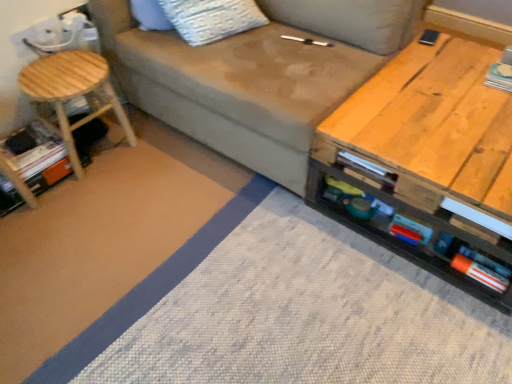
Identify the location of free location in front of white paper book at upper right, positioned as the 2th book in bottom-to-top order. (495, 99).